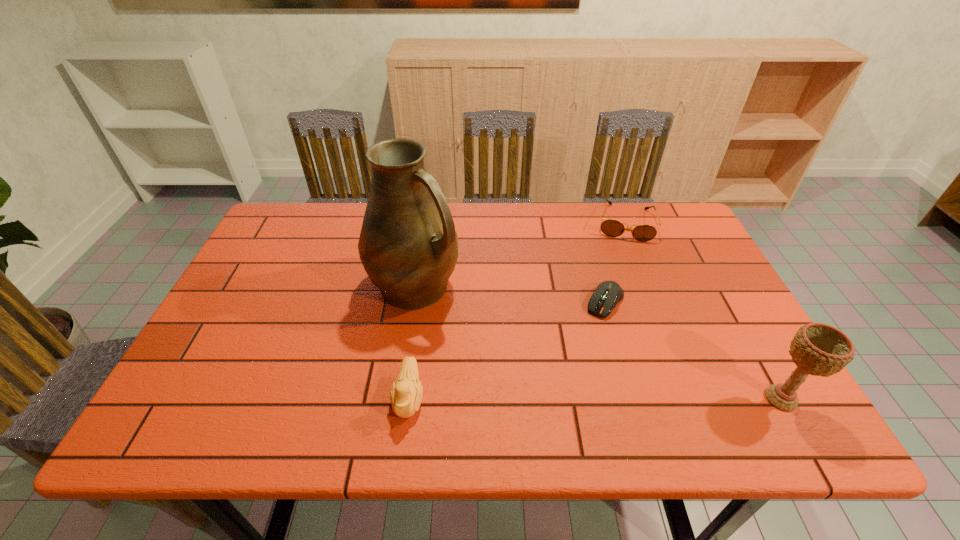
The height and width of the screenshot is (540, 960). Find the location of `vacant space that is in between the third tallest object and the chalice`. vacant space that is in between the third tallest object and the chalice is located at coordinates (595, 398).

I want to click on free spot between the fourth tallest object and the computer equipment, so click(x=615, y=262).

This screenshot has height=540, width=960. What are the coordinates of `unoccupied position between the fourth tallest object and the tallest object` in the screenshot? It's located at (519, 254).

Locate an element on the screen. free space between the tallest object and the third shortest object is located at coordinates pos(412,342).

Where is `free spot between the shortest object and the tallest object`? This screenshot has height=540, width=960. free spot between the shortest object and the tallest object is located at coordinates (510, 294).

Identify the location of vacant space in between the third shortest object and the farthest object. This screenshot has width=960, height=540. (517, 310).

Image resolution: width=960 pixels, height=540 pixels. What are the coordinates of `empty location between the third tallest object and the shortest object` in the screenshot? It's located at (507, 350).

The height and width of the screenshot is (540, 960). What are the coordinates of `vacant space that is in between the second tallest object and the duckling` in the screenshot? It's located at (595, 398).

This screenshot has height=540, width=960. Identify the location of free point between the second tallest object and the sunglasses. (703, 310).

Where is `empty space between the computer equipment and the sunglasses`? Image resolution: width=960 pixels, height=540 pixels. empty space between the computer equipment and the sunglasses is located at coordinates (615, 262).